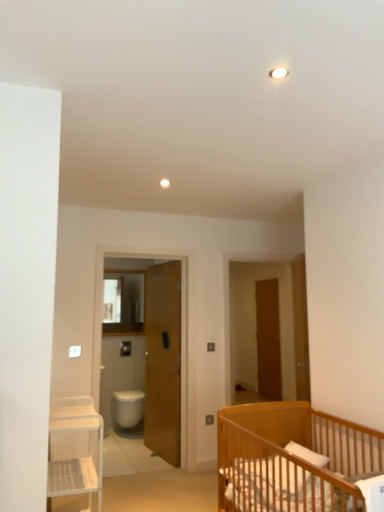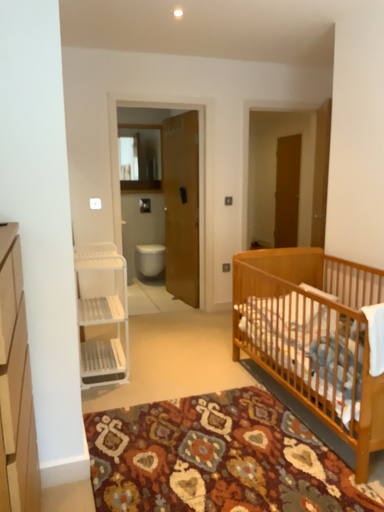
Question: Which way did the camera rotate in the video?

Choices:
 (A) rotated downward
 (B) rotated upward

Answer: (A)